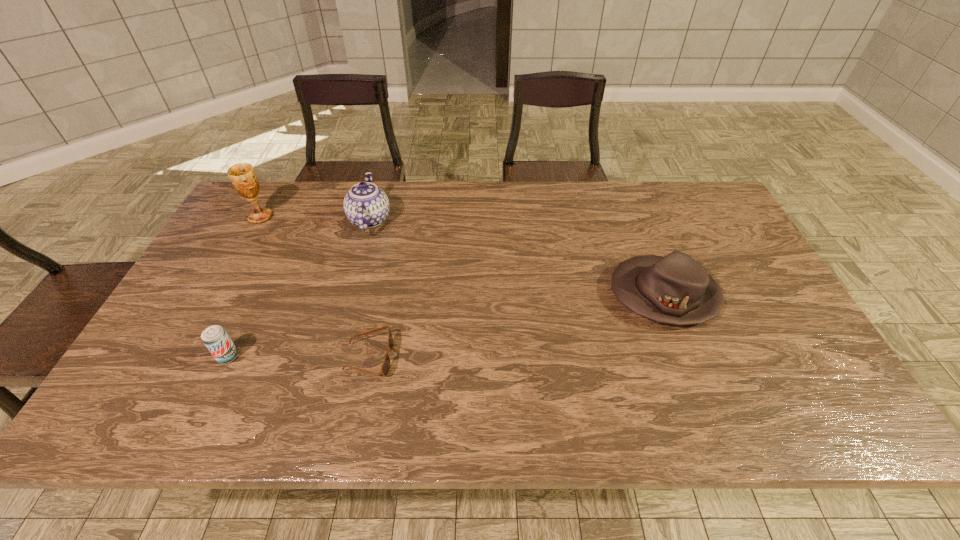
The image size is (960, 540). Find the location of `vacant area in the image that satisfies the following two spatial constraints: 1. at the spout of the chinaware; 2. on the front side of the beer can`. vacant area in the image that satisfies the following two spatial constraints: 1. at the spout of the chinaware; 2. on the front side of the beer can is located at coordinates (332, 356).